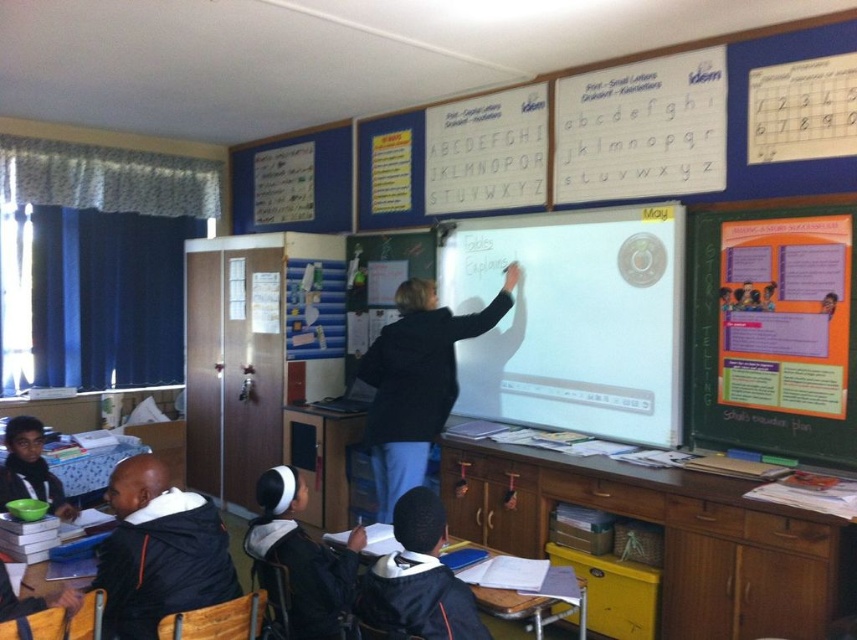
Which is above, black jacket at lower left or black fabric backpack at center?

black jacket at lower left is higher up.

Does point (178, 541) lie behind point (333, 573)?

That is False.

Which is behind, point (156, 557) or point (270, 528)?

Point (270, 528)

Locate an element on the screen. The image size is (857, 640). black jacket at lower left is located at coordinates (159, 552).

Is black jacket at lower left wider than black matte jacket at center?

No, black jacket at lower left is not wider than black matte jacket at center.

Can you confirm if black jacket at lower left is taller than black matte jacket at center?

No.

Does point (226, 561) lie behind point (472, 324)?

No, it is not.

Find the location of a particular element. Image resolution: width=857 pixels, height=640 pixels. black jacket at lower left is located at coordinates (159, 552).

Which is more to the left, black matte jacket at center or black fabric backpack at center?

black fabric backpack at center

Between point (387, 339) and point (276, 550), which one is positioned in front?

Point (276, 550) is in front.

I want to click on black matte jacket at center, so click(x=417, y=381).